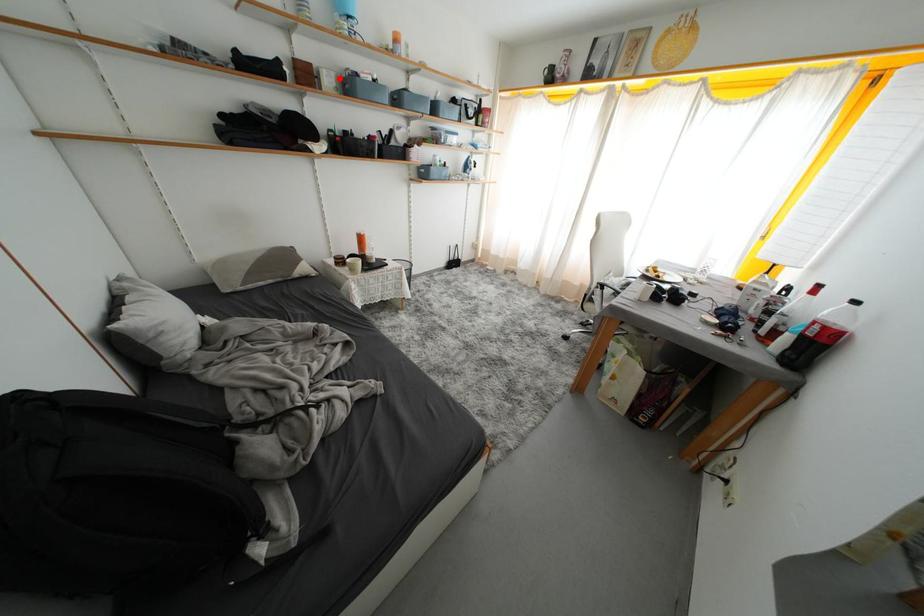
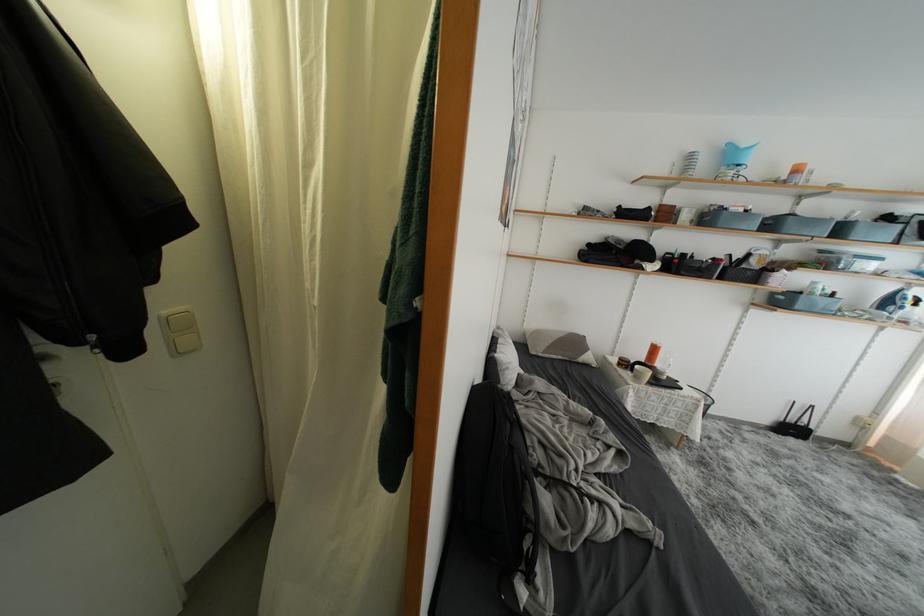
Find the pixel in the second image that matches the highlighted location in the first image.

(700, 215)